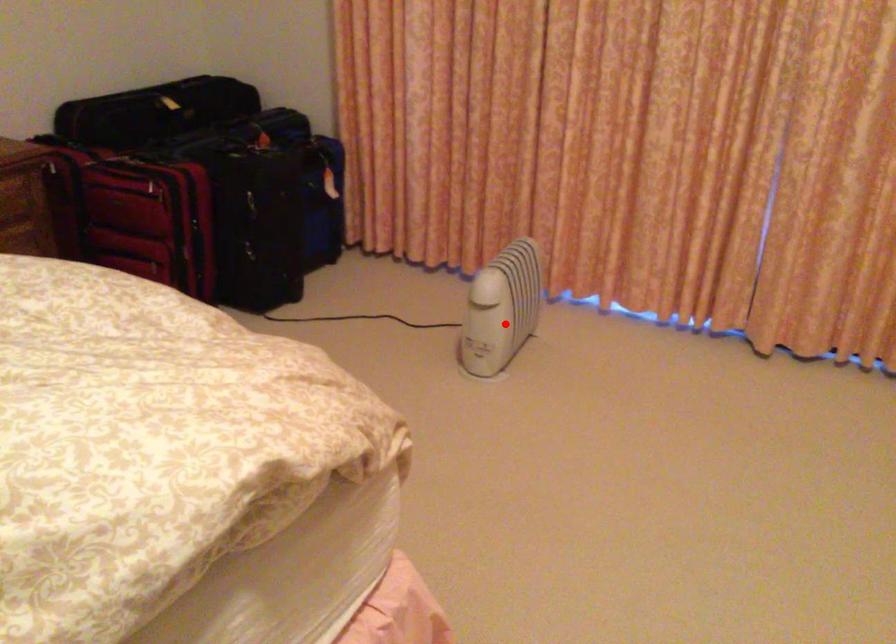
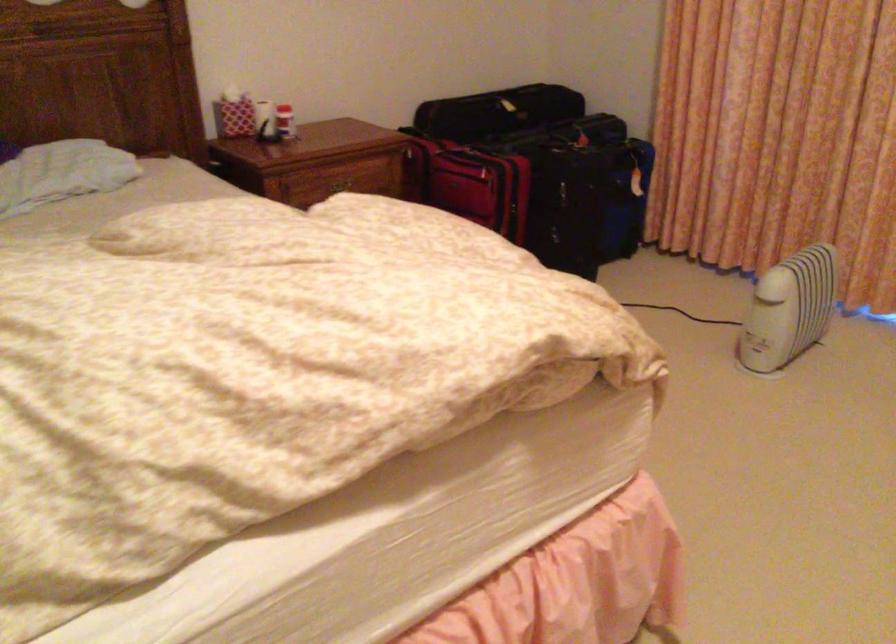
Question: I am providing you with two images of the same scene from different viewpoints. A red point is marked on the first image. Is the red point's position out of view in image 2?

Choices:
 (A) Yes
 (B) No

Answer: (B)